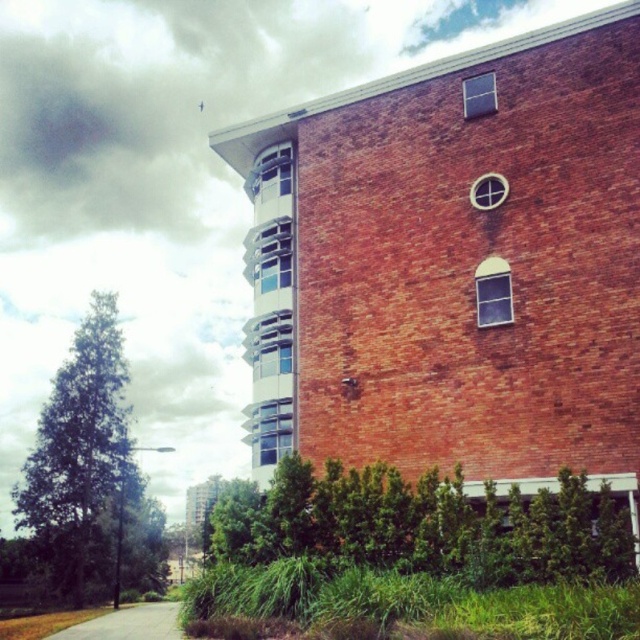
In the scene shown: You are standing at the point marked by coordinates (454, 264) in the image. What is the name of the structure you are currently located in?

The point marked by coordinates (454, 264) corresponds to the red brick building at center, so you are located in the red brick building at center.

You are a delivery driver approaching the red brick building at center and the smooth asphalt road at lower left. Which one is closer to the ground level?

The smooth asphalt road at lower left is closer to the ground level because the red brick building at center is located above it.